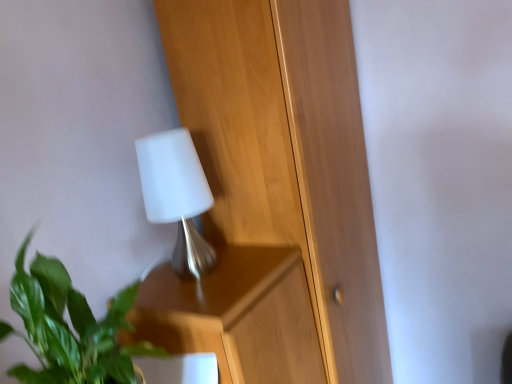
Question: From the image's perspective, is green leafy plant at lower left under white matte lamp at upper center?

Choices:
 (A) no
 (B) yes

Answer: (B)

Question: Would you say green leafy plant at lower left contains white matte lamp at upper center?

Choices:
 (A) no
 (B) yes

Answer: (A)

Question: Considering the relative positions of green leafy plant at lower left and white matte lamp at upper center in the image provided, is green leafy plant at lower left to the left of white matte lamp at upper center from the viewer's perspective?

Choices:
 (A) yes
 (B) no

Answer: (A)

Question: Is green leafy plant at lower left not within white matte lamp at upper center?

Choices:
 (A) yes
 (B) no

Answer: (A)

Question: Is the depth of green leafy plant at lower left greater than that of white matte lamp at upper center?

Choices:
 (A) no
 (B) yes

Answer: (A)

Question: Based on their positions, is white matte lamp at upper center located to the left or right of green leafy plant at lower left?

Choices:
 (A) right
 (B) left

Answer: (A)

Question: Looking at their shapes, would you say white matte lamp at upper center is wider or thinner than green leafy plant at lower left?

Choices:
 (A) thin
 (B) wide

Answer: (A)

Question: From a real-world perspective, is white matte lamp at upper center above or below green leafy plant at lower left?

Choices:
 (A) above
 (B) below

Answer: (A)

Question: Looking at the image, does white matte lamp at upper center seem bigger or smaller compared to green leafy plant at lower left?

Choices:
 (A) big
 (B) small

Answer: (B)

Question: In the image, is green leafy plant at lower left on the left side or the right side of wooden dresser at center?

Choices:
 (A) left
 (B) right

Answer: (A)

Question: Relative to wooden dresser at center, is green leafy plant at lower left in front or behind?

Choices:
 (A) front
 (B) behind

Answer: (A)

Question: Would you say green leafy plant at lower left is inside or outside wooden dresser at center?

Choices:
 (A) outside
 (B) inside

Answer: (A)

Question: Is green leafy plant at lower left taller or shorter than wooden dresser at center?

Choices:
 (A) short
 (B) tall

Answer: (A)

Question: Relative to white matte lamp at upper center, is wooden dresser at center in front or behind?

Choices:
 (A) front
 (B) behind

Answer: (B)

Question: Considering the positions of wooden dresser at center and white matte lamp at upper center in the image, is wooden dresser at center wider or thinner than white matte lamp at upper center?

Choices:
 (A) wide
 (B) thin

Answer: (A)